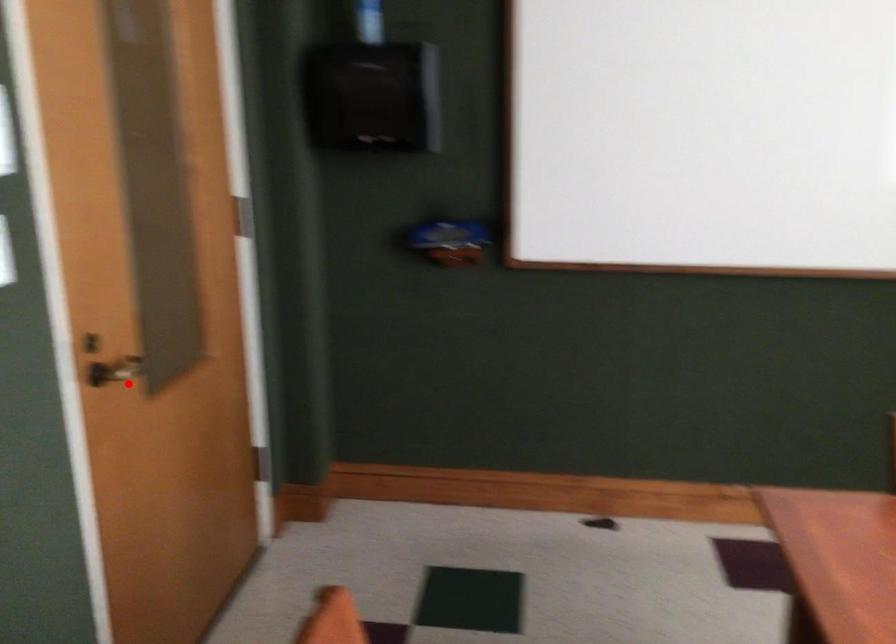
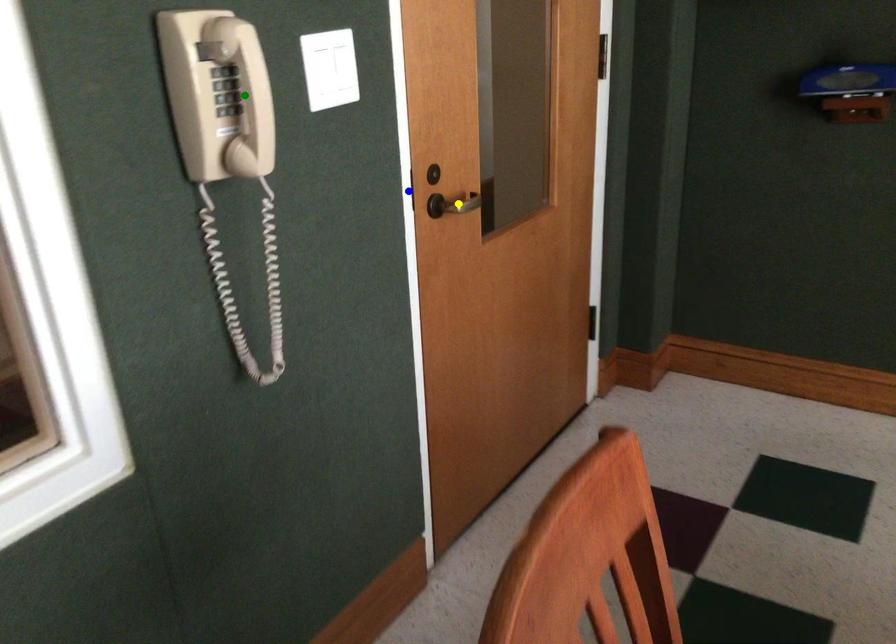
Question: I am providing you with two images of the same scene from different viewpoints. A red point is marked on the first image. You are given multiple points on the second image. Which point in image 2 represents the same 3d spot as the red point in image 1?

Choices:
 (A) green point
 (B) blue point
 (C) yellow point

Answer: (C)